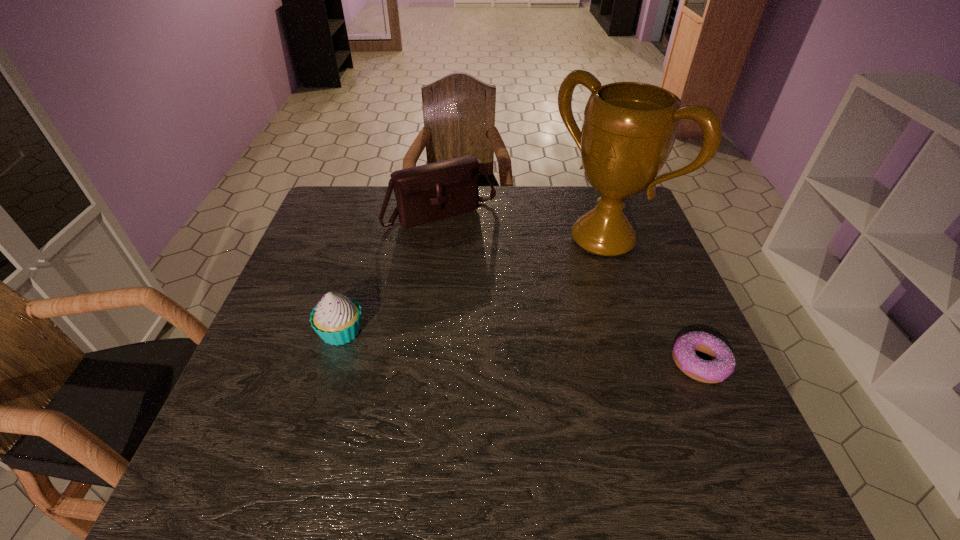
Where is `the third tallest object`? The height and width of the screenshot is (540, 960). the third tallest object is located at coordinates (336, 319).

Find the location of a particular element. This screenshot has width=960, height=540. the shortest object is located at coordinates (722, 365).

I want to click on the third shortest object, so click(430, 192).

Locate an element on the screen. This screenshot has width=960, height=540. award is located at coordinates (629, 128).

Image resolution: width=960 pixels, height=540 pixels. What are the coordinates of `blank area located on the left of the cupcake` in the screenshot? It's located at (275, 331).

Locate an element on the screen. vacant region located 0.100m on the back of the doughnut is located at coordinates (677, 309).

Where is `vacant space located 0.290m on the front flap of the shoulder bag`? The image size is (960, 540). vacant space located 0.290m on the front flap of the shoulder bag is located at coordinates (512, 294).

Where is `vacant area located 0.220m on the front flap of the shoulder bag`? vacant area located 0.220m on the front flap of the shoulder bag is located at coordinates (499, 278).

Locate an element on the screen. The width and height of the screenshot is (960, 540). free space located 0.130m on the front flap of the shoulder bag is located at coordinates (484, 258).

Locate an element on the screen. free space located 0.360m on the front of the award with the decoration is located at coordinates (475, 334).